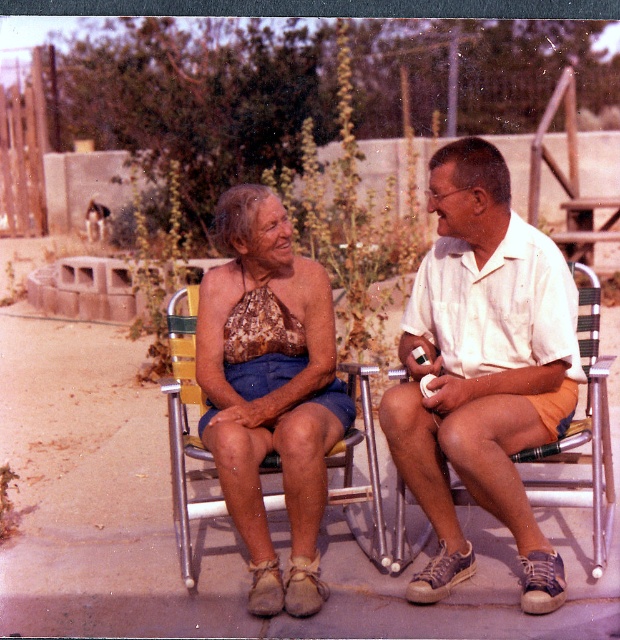
You are a photographer trying to capture a closeup shot of the brown sequined top at center and the metallic silver beach chair at center. Which object should you focus on first if you want to ensure both are in sharp focus, given their height difference?

The brown sequined top at center is taller than the metallic silver beach chair at center, so you should focus on the brown sequined top at center first to ensure both are in sharp focus.

You are planning to take a photo of the matte brown halter top at center and the metallic silver beach chair at center. Which object should you focus on first if you want to capture both in the frame without moving the camera?

You should focus on the matte brown halter top at center first since it is positioned to the left of the metallic silver beach chair at center, allowing both to be captured in the frame without moving the camera.

You are taking a photo of two people sitting on metal folding chairs in a garden. The camera is positioned such that you can see two points marked in the image. One point is at coordinate point (503,472) and the other at point (228,372). Which of these two points is nearer to the camera?

Point (503,472) is closer to the camera than point (228,372).